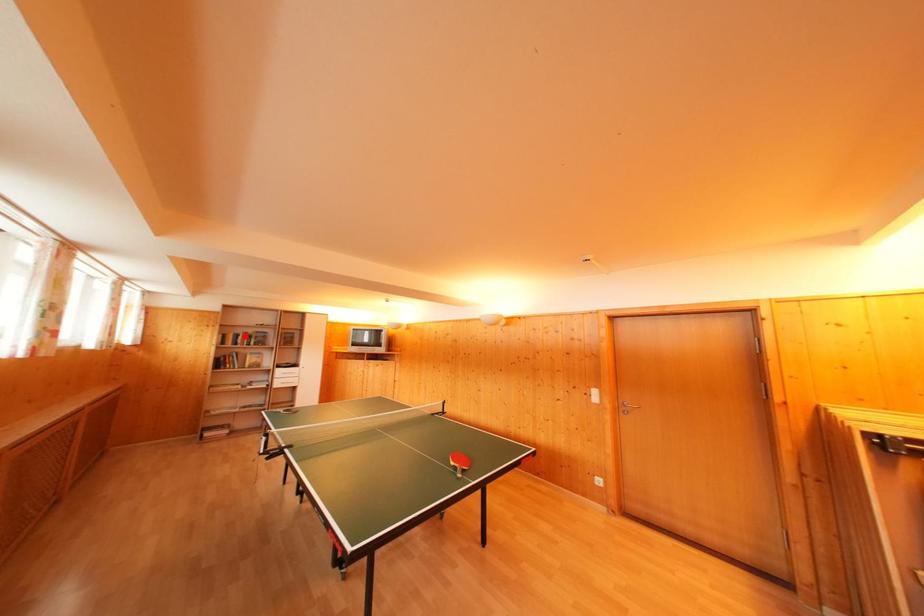
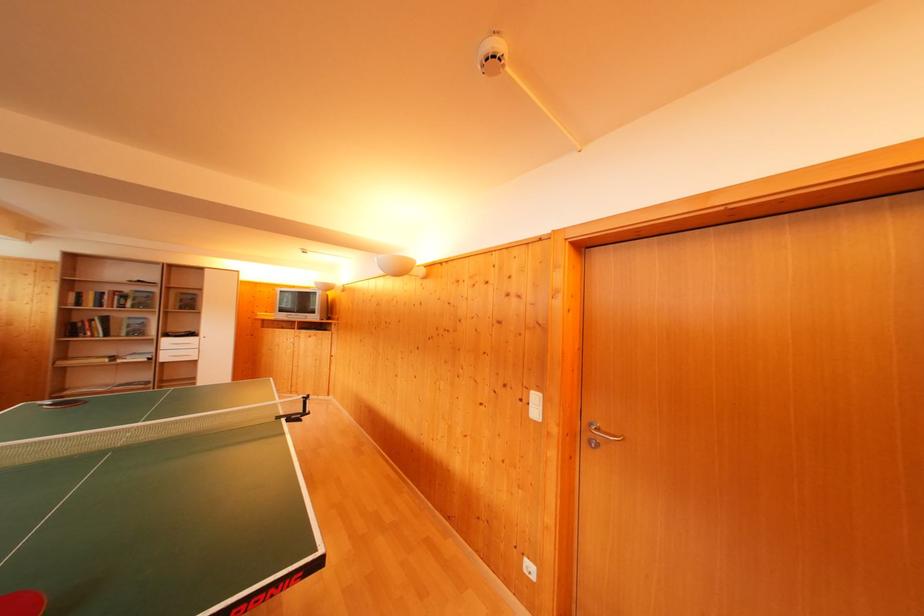
In the second image, find the point that corresponds to the highlighted location in the first image.

(112, 294)